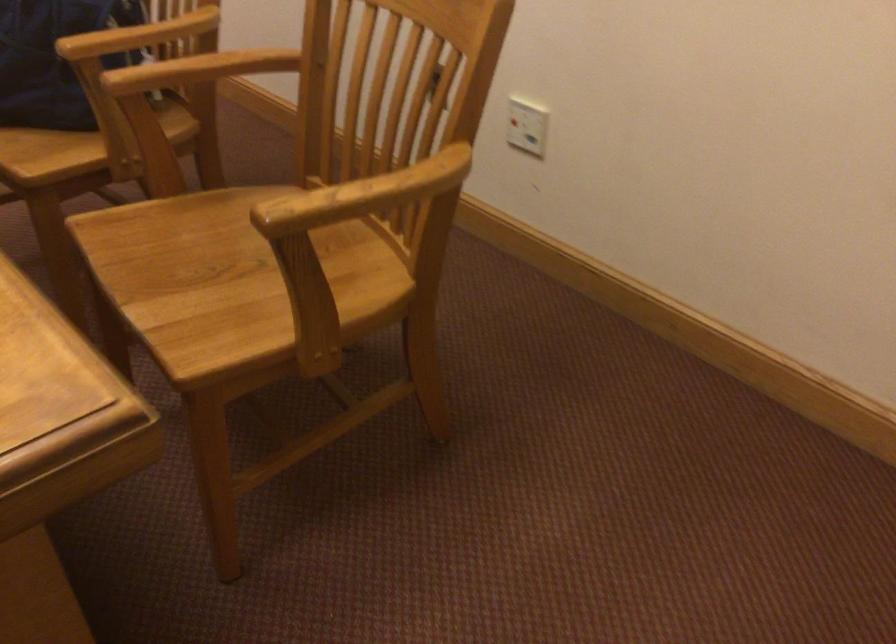
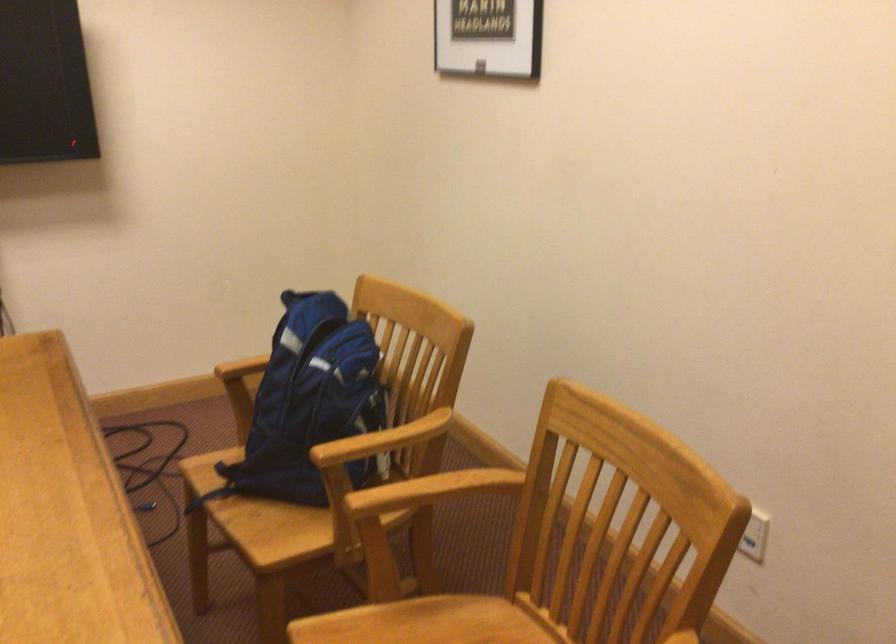
In the second image, find the point that corresponds to point (208, 207) in the first image.

(415, 627)